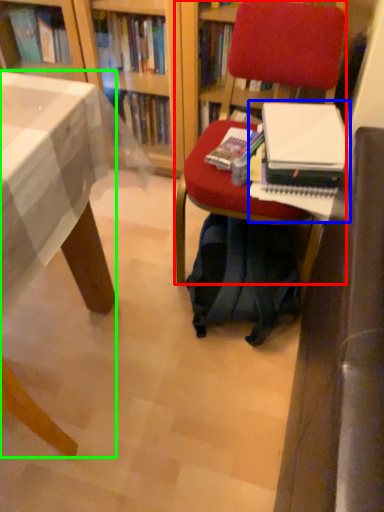
Question: Based on their relative distances, which object is nearer to chair (highlighted by a red box)? Choose from paperback book (highlighted by a blue box) and desk (highlighted by a green box).

Choices:
 (A) paperback book
 (B) desk

Answer: (A)